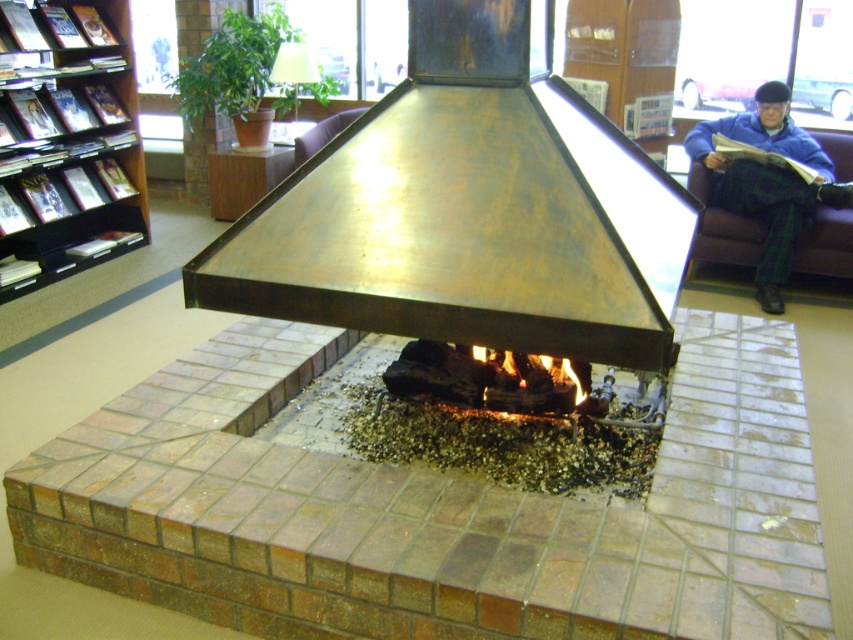
Question: Based on their relative distances, which object is nearer to the blue plaid pants at upper right?

Choices:
 (A) charcoal wood fire at center
 (B) shiny brass fireplace at center
 (C) black wood bookshelf at left

Answer: (B)

Question: In this image, where is shiny brass fireplace at center located relative to charcoal wood fire at center?

Choices:
 (A) above
 (B) below

Answer: (A)

Question: Is blue plaid pants at upper right smaller than charcoal wood fire at center?

Choices:
 (A) yes
 (B) no

Answer: (B)

Question: Which point is closer to the camera taking this photo?

Choices:
 (A) (505, 371)
 (B) (773, 248)
 (C) (489, 355)
 (D) (73, 134)

Answer: (A)

Question: Among these points, which one is farthest from the camera?

Choices:
 (A) (489, 132)
 (B) (430, 349)

Answer: (B)

Question: Can you confirm if charcoal wood fire at center is thinner than charcoal black wood at center?

Choices:
 (A) no
 (B) yes

Answer: (A)